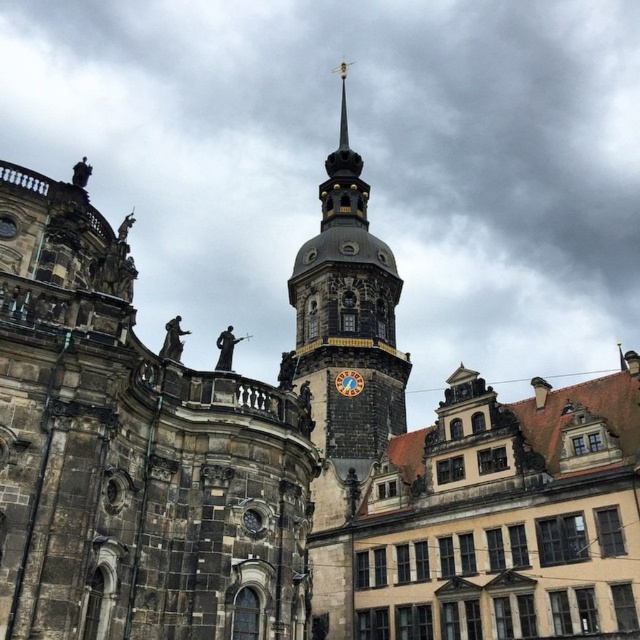
Which is behind, point (292, 280) or point (339, 380)?

The point (292, 280) is more distant.

Is point (330, 228) closer to camera compared to point (362, 378)?

That is False.

This screenshot has height=640, width=640. I want to click on golden ornate clock tower at center, so click(x=348, y=314).